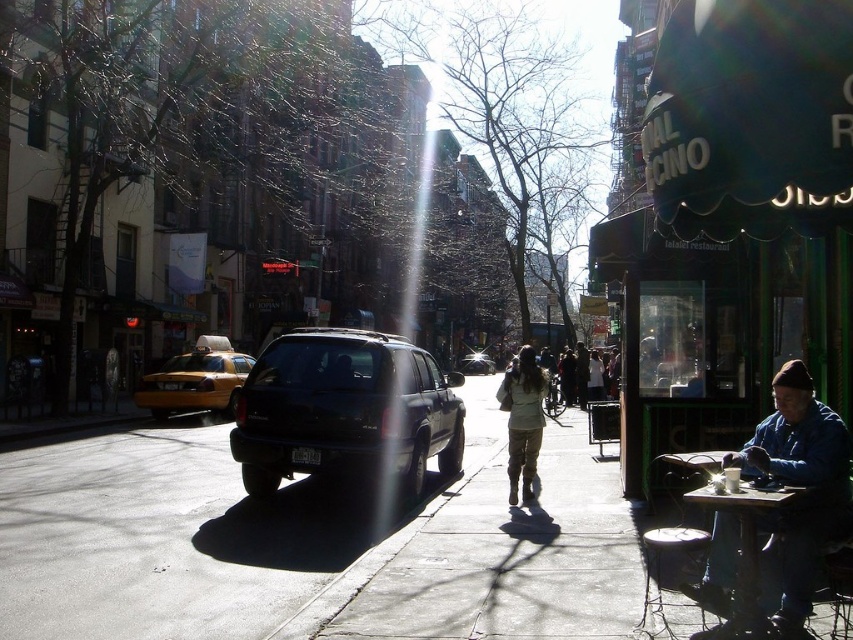
Does yellow matte taxi at left have a lesser height compared to wooden table at lower right?

Incorrect, yellow matte taxi at left's height does not fall short of wooden table at lower right's.

Image resolution: width=853 pixels, height=640 pixels. Describe the element at coordinates (195, 380) in the screenshot. I see `yellow matte taxi at left` at that location.

Where is `yellow matte taxi at left`? This screenshot has width=853, height=640. yellow matte taxi at left is located at coordinates (195, 380).

Is wooden table at lower right taller than khaki cotton pants at center?

No, wooden table at lower right is not taller than khaki cotton pants at center.

Who is taller, wooden table at lower right or khaki cotton pants at center?

Standing taller between the two is khaki cotton pants at center.

Between point (740, 496) and point (527, 486), which one is positioned in front?

Positioned in front is point (740, 496).

Identify the location of wooden table at lower right. (746, 556).

Is wooden table at lower right thinner than shiny black suv at center?

Correct, wooden table at lower right's width is less than shiny black suv at center's.

Between wooden table at lower right and shiny black suv at center, which one appears on the right side from the viewer's perspective?

From the viewer's perspective, shiny black suv at center appears more on the right side.

Who is more distant from viewer, (795,502) or (465,364)?

Positioned behind is point (465,364).

Where is `wooden table at lower right`? The image size is (853, 640). wooden table at lower right is located at coordinates (746, 556).